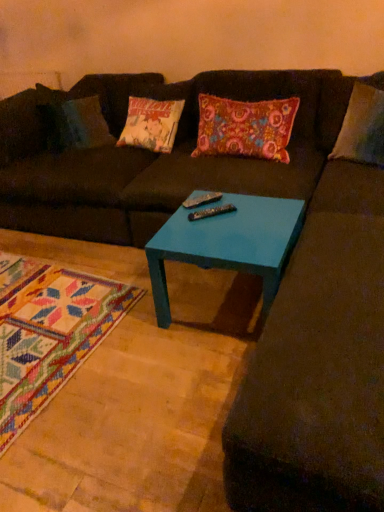
This screenshot has height=512, width=384. I want to click on vacant space situated on the left part of black plastic remote at center, the second remote when ordered from back to front, so click(x=177, y=224).